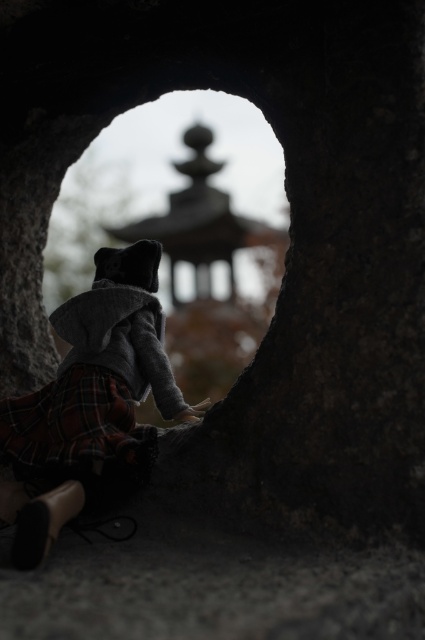
Question: Which object is closer to the camera taking this photo?

Choices:
 (A) plaid fabric skirt at center
 (B) plaid fabric at lower left

Answer: (A)

Question: Is plaid fabric skirt at center behind plaid fabric at lower left?

Choices:
 (A) yes
 (B) no

Answer: (B)

Question: Is plaid fabric skirt at center to the left of plaid fabric at lower left from the viewer's perspective?

Choices:
 (A) yes
 (B) no

Answer: (B)

Question: Among these points, which one is nearest to the camera?

Choices:
 (A) (93, 305)
 (B) (99, 390)

Answer: (B)

Question: Does plaid fabric skirt at center appear on the right side of plaid fabric at lower left?

Choices:
 (A) no
 (B) yes

Answer: (B)

Question: Which point is farther to the camera?

Choices:
 (A) (158, 317)
 (B) (0, 436)

Answer: (A)